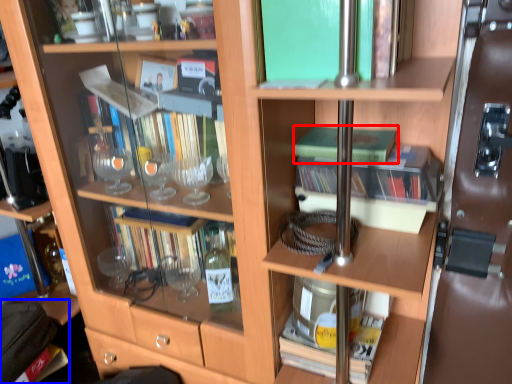
Question: Which point is further to the camera, book (highlighted by a red box) or handbag (highlighted by a blue box)?

Choices:
 (A) book
 (B) handbag

Answer: (B)